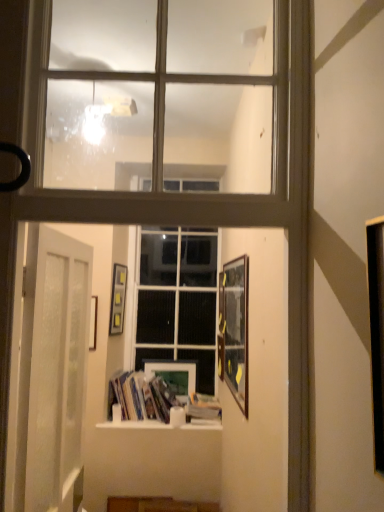
Question: From a real-world perspective, does clear glass window at upper center stand above wooden framed picture at right, arranged as the first picture frame when viewed from the front?

Choices:
 (A) no
 (B) yes

Answer: (B)

Question: Does clear glass window at upper center lie in front of wooden framed picture at right, arranged as the first picture frame when viewed from the front?

Choices:
 (A) no
 (B) yes

Answer: (B)

Question: Is clear glass window at upper center far from wooden framed picture at right, which appears as the first picture frame when viewed from the right?

Choices:
 (A) yes
 (B) no

Answer: (A)

Question: Is clear glass window at upper center bigger than wooden framed picture at right, arranged as the first picture frame when viewed from the front?

Choices:
 (A) yes
 (B) no

Answer: (A)

Question: Does clear glass window at upper center come behind wooden framed picture at right, the 3th picture frame in the left-to-right sequence?

Choices:
 (A) yes
 (B) no

Answer: (B)

Question: Is wooden framed picture at right, the 3th picture frame in the left-to-right sequence, at the back of clear glass window at upper center?

Choices:
 (A) yes
 (B) no

Answer: (B)

Question: Is hardcover book at center surrounding matte wooden picture frame at center, the first picture frame viewed from the back?

Choices:
 (A) no
 (B) yes

Answer: (A)

Question: Could you tell me if hardcover book at center is facing matte wooden picture frame at center, arranged as the 2th picture frame when viewed from the left?

Choices:
 (A) yes
 (B) no

Answer: (B)

Question: Can you confirm if hardcover book at center is smaller than matte wooden picture frame at center, the second picture frame in the right-to-left sequence?

Choices:
 (A) yes
 (B) no

Answer: (B)

Question: Is hardcover book at center closer to the viewer compared to matte wooden picture frame at center, the second picture frame in the right-to-left sequence?

Choices:
 (A) no
 (B) yes

Answer: (B)

Question: From a real-world perspective, is hardcover book at center under matte wooden picture frame at center, the second picture frame in the right-to-left sequence?

Choices:
 (A) yes
 (B) no

Answer: (A)

Question: Is hardcover book at center looking in the opposite direction of matte wooden picture frame at center, which is counted as the 3th picture frame, starting from the front?

Choices:
 (A) yes
 (B) no

Answer: (B)

Question: Does wooden framed picture at right, arranged as the first picture frame when viewed from the front, appear on the left side of matte wooden picture frame at center, the first picture frame viewed from the back?

Choices:
 (A) no
 (B) yes

Answer: (A)